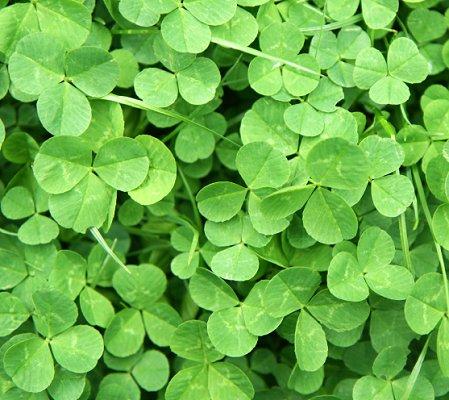
Image resolution: width=449 pixels, height=400 pixels. I want to click on plant, so click(281, 302).